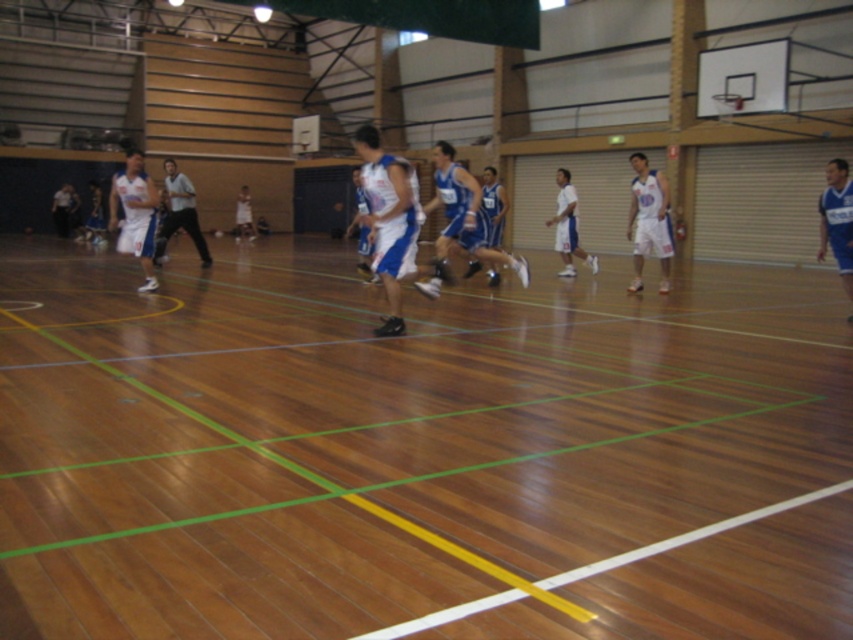
You are a photographer standing at the center of the gymnasium. You want to take a photo of both the white jersey at left and the white jersey at right. Which player should you focus on first if you want to capture the taller one?

The white jersey at left is taller than the white jersey at right, so you should focus on the white jersey at left first to capture the taller player.